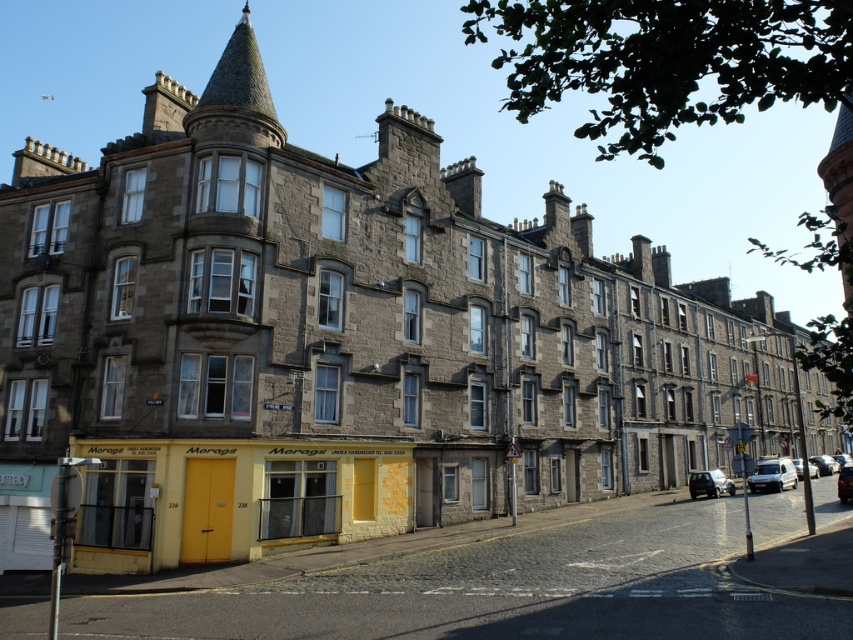
You are a delivery person who needs to park your vehicle in a tight space near the commercial buildings. You have two options to choose from, the white matte van at lower right and the metallic silver car at lower right. Which vehicle would be easier to maneuver in the narrow area?

The white matte van at lower right is smaller than the metallic silver car at lower right, so it would be easier to maneuver in a narrow area.

You are a delivery person arriving at this historic area with a white matte van at lower right and a silver metallic car at center. You need to park your vehicle. Considering the size of your vehicle, which one would be more suitable to park in a compact parking spot?

The white matte van at lower right is smaller than the silver metallic car at center, so it would be more suitable to park in a compact parking spot.

You are standing at the center of the image looking forward. Which direction should you turn to see the white matte van at lower right?

You should turn to your right to see the white matte van at lower right since it is located at lower right from your current position.